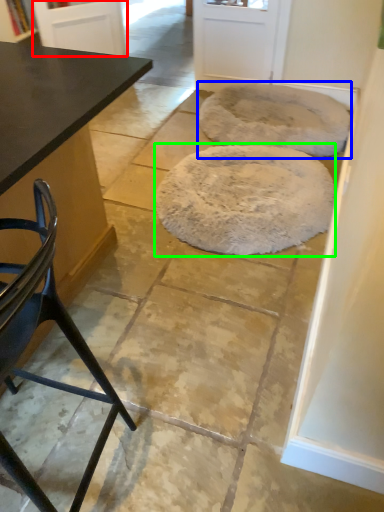
Question: Which object is the closest to the screen door (highlighted by a red box)? Choose among these: mat (highlighted by a blue box) or mat (highlighted by a green box).

Choices:
 (A) mat
 (B) mat

Answer: (A)